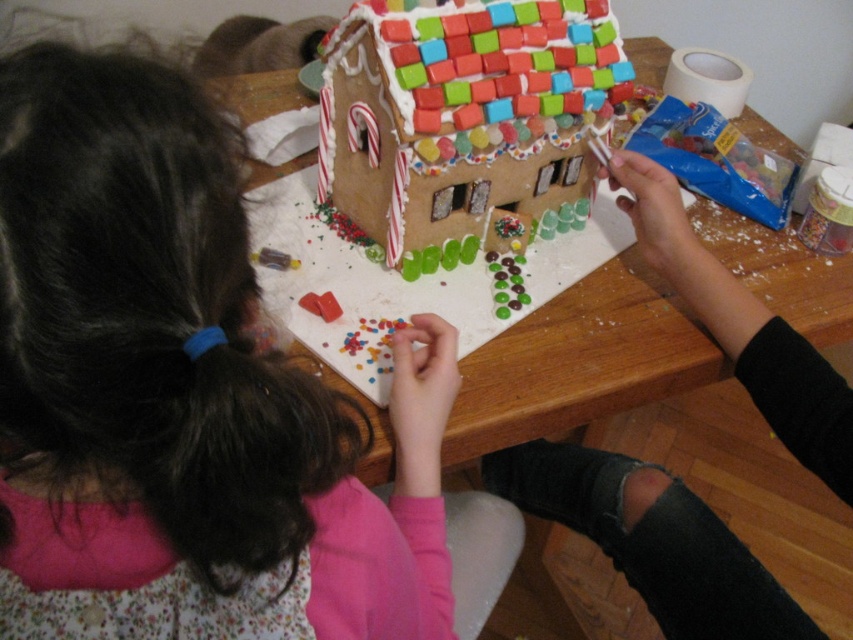
You are standing in front of the wooden table at center and want to hand a candy to the person wearing the matte pink shirt at center. In which direction should you move to reach them?

The matte pink shirt at center is to the left of the wooden table at center, so you should move to your left to reach them.

You are standing in front of the wooden table with the gingerbread house. There is a point at coordinates (169, 390). What object is this point located on?

The point at (169, 390) is located on the matte pink shirt at center.

You are organizing a holiday craft fair and need to ensure that the display table can accommodate both the matte pink shirt at center and the wooden table at center. Based on their sizes, which object should be placed first to maximize space efficiency?

The wooden table at center should be placed first since it occupies more space than the matte pink shirt at center, allowing for better space utilization.